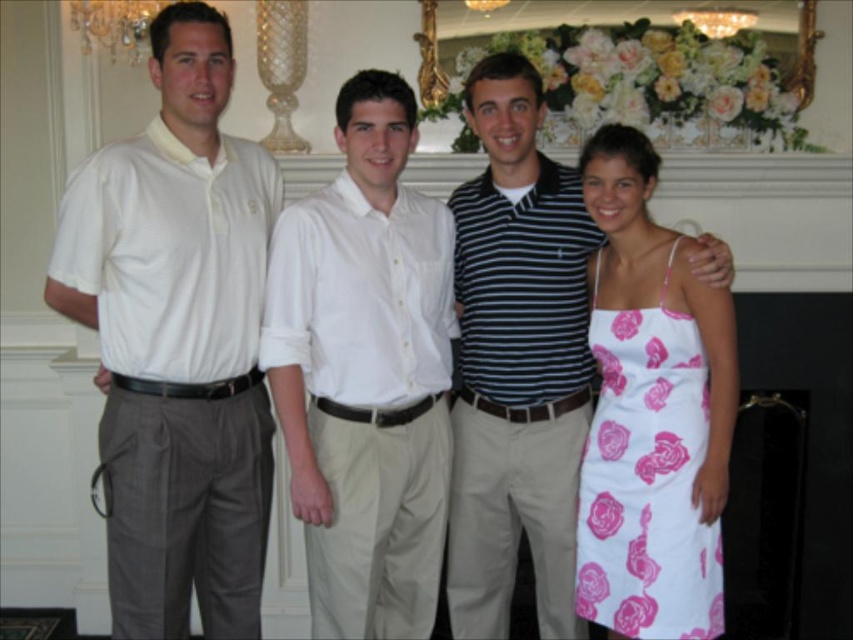
You are a photographer at a formal event and need to capture a group photo of the white cotton shirt at left and the beige trousers in the middle. The camera you are using has a maximum focus range of 8 feet between subjects. Can you ensure both subjects will be in focus?

The distance between the white cotton shirt at left and beige trousers in the middle is 7.77 feet, which is within the camera maximum focus range of 8 feet. Therefore, both subjects will be in focus.

You are a photographer setting up for an event. You need to position a spotlight that has a 2.5 meter range. The spotlight is placed at the crystal chandelier at upper left. Will the pink floral fabric dress at right be illuminated by the spotlight?

The pink floral fabric dress at right is 2.25 meters from the crystal chandelier at upper left. Since the spotlight has a 2.5 meter range, it will illuminate the pink floral fabric dress at right as the distance is within the range.

You are standing in the room and want to determine which of the two points, point [125,253] or point [502,272], is nearer to you. Based on the scene description, which point is closer?

Result: Point [125,253] is closer to the camera than point [502,272], so it is the nearer one.